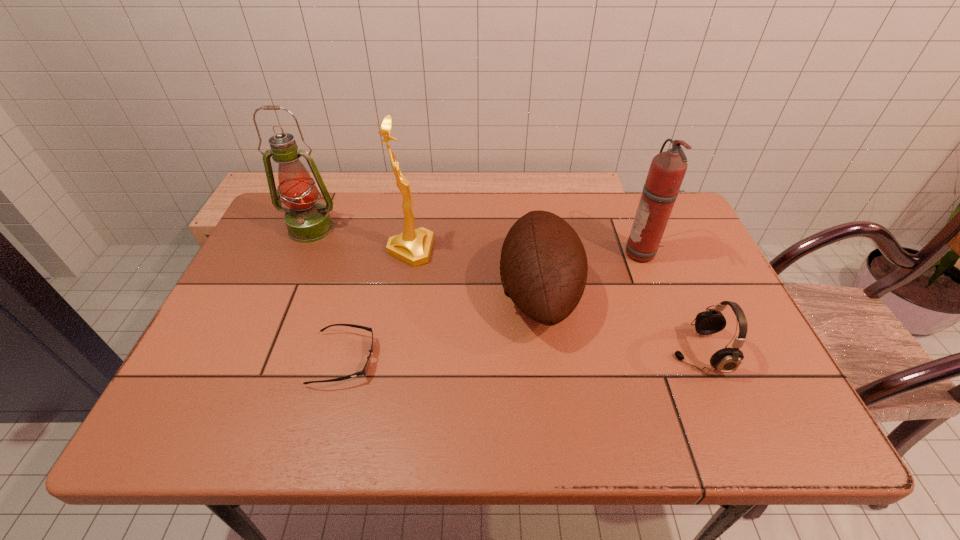
In order to click on oil lamp located in the far edge section of the desktop in this screenshot , I will do `click(307, 221)`.

Locate an element on the screen. The image size is (960, 540). fire extinguisher that is positioned at the far edge is located at coordinates (667, 170).

The height and width of the screenshot is (540, 960). I want to click on object present at the left edge, so click(307, 221).

At what (x,y) coordinates should I click in order to perform the action: click on fire extinguisher that is at the right edge. Please return your answer as a coordinate pair (x, y). Looking at the image, I should click on (667, 170).

Find the location of a particular element. This screenshot has width=960, height=540. headset that is positioned at the right edge is located at coordinates (727, 360).

In order to click on object at the far left corner in this screenshot , I will do `click(307, 221)`.

The image size is (960, 540). Find the location of `object that is at the far right corner`. object that is at the far right corner is located at coordinates (667, 170).

The height and width of the screenshot is (540, 960). In the image, there is a desktop. What are the coordinates of `vacant space at the far edge` in the screenshot? It's located at (514, 221).

You are a GUI agent. You are given a task and a screenshot of the screen. Output one action in this format:
    pyautogui.click(x=<x>, y=<y>)
    Task: Click on the vacant space at the near edge of the desktop
    This screenshot has height=540, width=960.
    Given the screenshot: What is the action you would take?
    pos(622,415)

Locate an element on the screen. The height and width of the screenshot is (540, 960). free space at the left edge of the desktop is located at coordinates (266, 285).